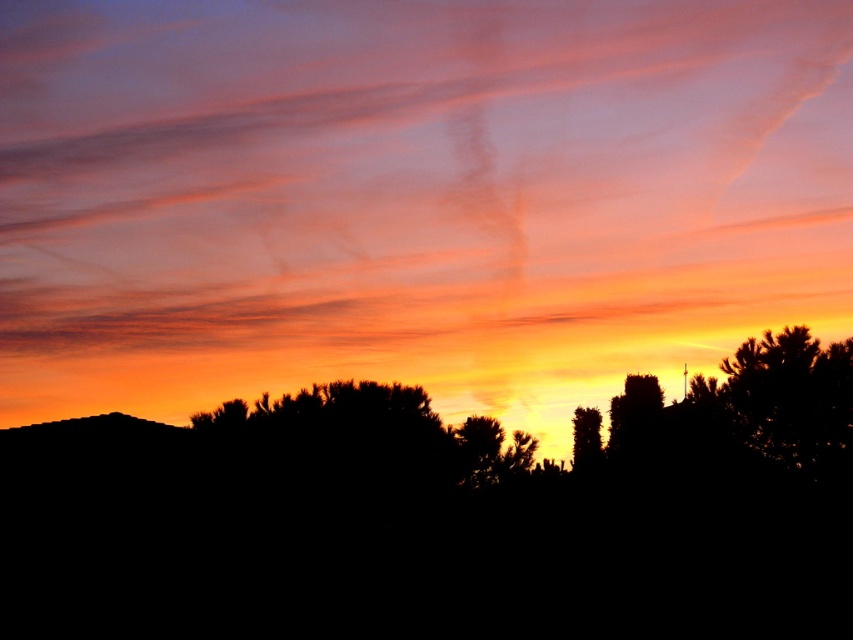
Between point (323, 65) and point (601, 417), which one is positioned in front?

Positioned in front is point (601, 417).

In the scene shown: Is translucent orange cloud at upper center taller than silhouette tree at center?

Indeed, translucent orange cloud at upper center has a greater height compared to silhouette tree at center.

Which is behind, point (337, 122) or point (578, 448)?

Positioned behind is point (337, 122).

This screenshot has width=853, height=640. Find the location of `translucent orange cloud at upper center`. translucent orange cloud at upper center is located at coordinates (410, 196).